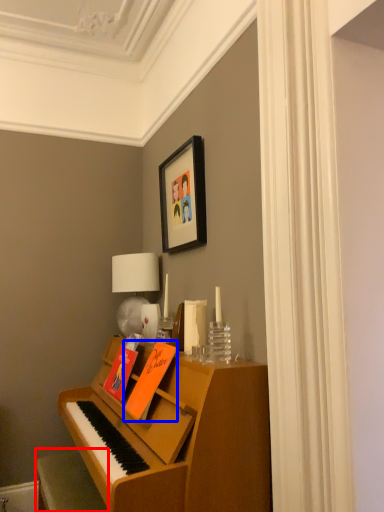
Question: Which object is further to the camera taking this photo, furniture (highlighted by a red box) or book (highlighted by a blue box)?

Choices:
 (A) furniture
 (B) book

Answer: (B)